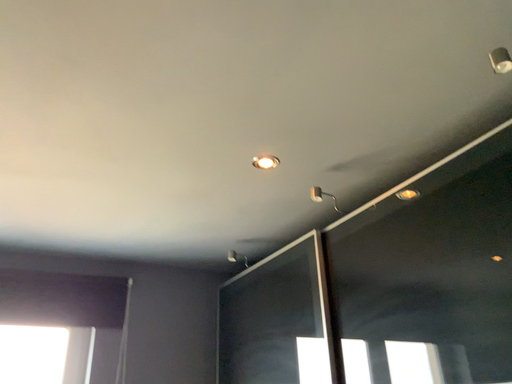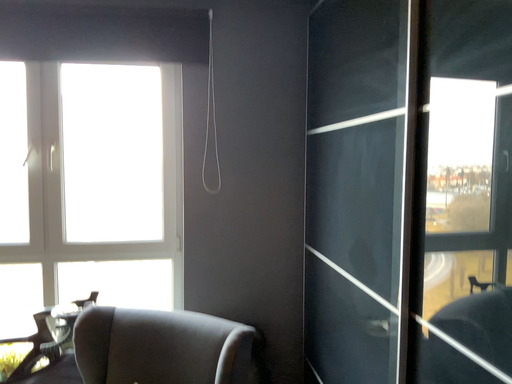
Question: Which way did the camera rotate in the video?

Choices:
 (A) rotated upward
 (B) rotated downward

Answer: (B)